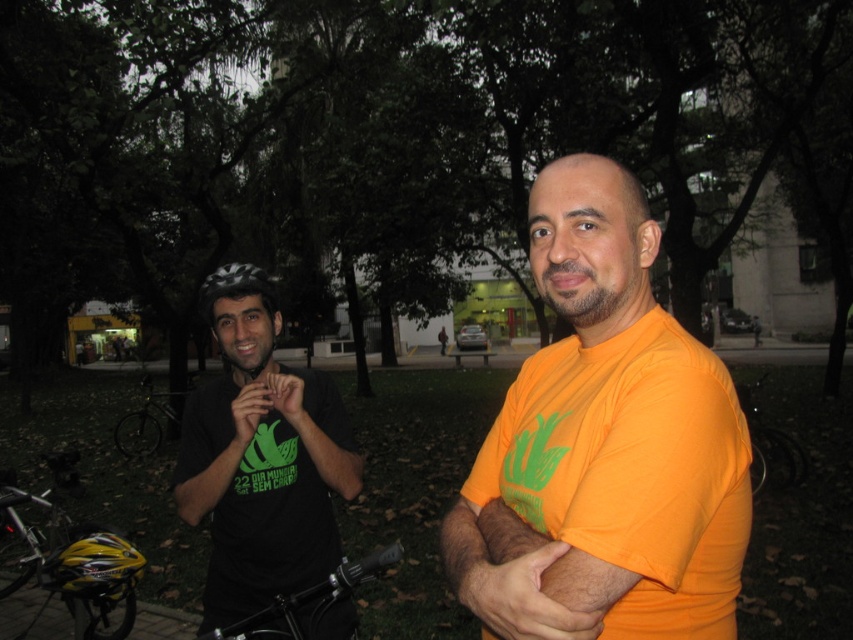
You are a photographer setting up a tripod to take a group photo of the two people in the scene. The tripod has a height adjustment feature. You need to ensure that the black matte helmet at left and the black matte shirt at center are both clearly visible in the photo. Based on their heights, what should you do with the tripod?

Since the black matte helmet at left is much taller than the black matte shirt at center, you should adjust the tripod to a lower height to ensure both are visible without one blocking the other.